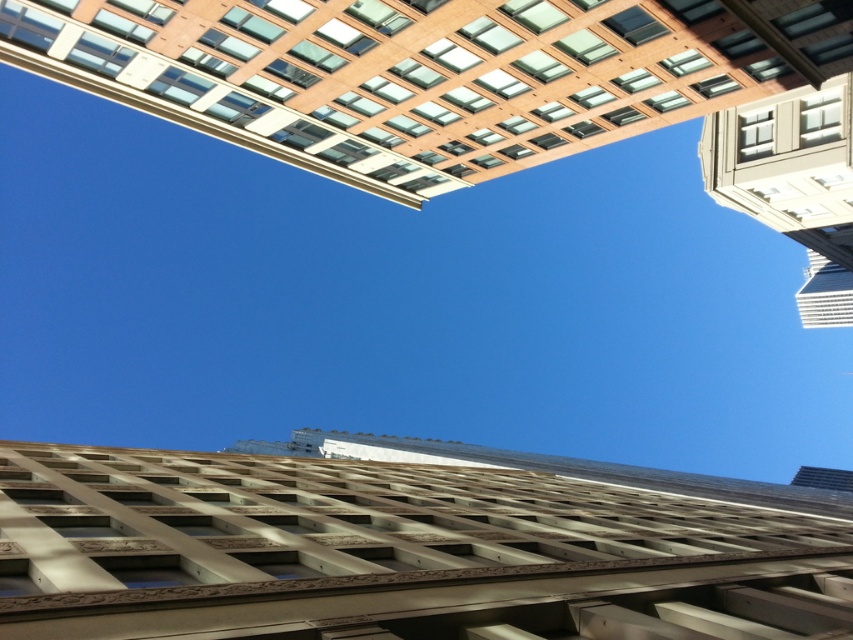
Question: Is brown brick building at upper center positioned before white stone building at upper right?

Choices:
 (A) yes
 (B) no

Answer: (A)

Question: Estimate the real-world distances between objects in this image. Which object is farther from the brown brick building at upper center?

Choices:
 (A) beige textured facade at center
 (B) white stone building at upper right

Answer: (B)

Question: Is brown brick building at upper center below white stone building at upper right?

Choices:
 (A) no
 (B) yes

Answer: (B)

Question: Which point is closer to the camera?

Choices:
 (A) (283, 556)
 (B) (718, 76)

Answer: (A)

Question: Which point appears farthest from the camera in this image?

Choices:
 (A) (730, 132)
 (B) (289, 36)

Answer: (A)

Question: Is brown brick building at upper center smaller than white stone building at upper right?

Choices:
 (A) no
 (B) yes

Answer: (B)